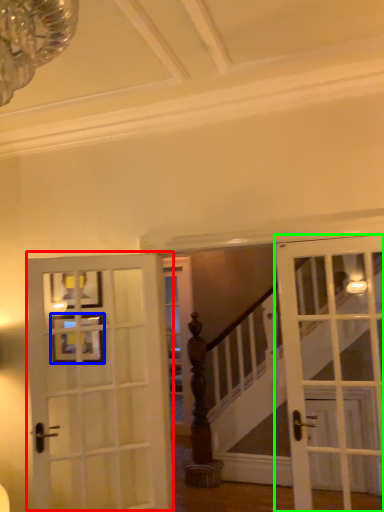
Question: Which object is the farthest from door (highlighted by a red box)? Choose among these: picture frame (highlighted by a blue box) or door (highlighted by a green box).

Choices:
 (A) picture frame
 (B) door

Answer: (B)